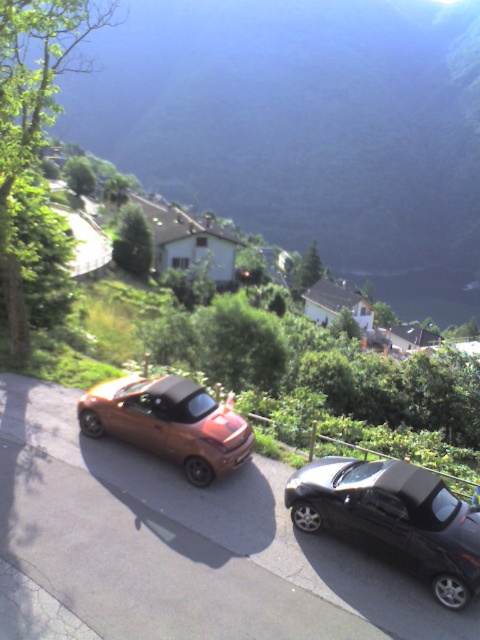
Question: Which point is farther to the camera?

Choices:
 (A) shiny black sedan at lower right
 (B) matte orange car at center
 (C) metallic orange car at center

Answer: (B)

Question: Does shiny black sedan at lower right have a greater width compared to matte orange car at center?

Choices:
 (A) no
 (B) yes

Answer: (A)

Question: Is shiny black sedan at lower right to the left of matte orange car at center from the viewer's perspective?

Choices:
 (A) no
 (B) yes

Answer: (A)

Question: Is metallic orange car at center below shiny black sedan at lower right?

Choices:
 (A) yes
 (B) no

Answer: (A)

Question: Which of these objects is positioned farthest from the shiny black sedan at lower right?

Choices:
 (A) metallic orange car at center
 (B) matte orange car at center

Answer: (B)

Question: Among these points, which one is nearest to the camera?

Choices:
 (A) (263, 461)
 (B) (348, 477)
 (C) (227, 408)

Answer: (B)